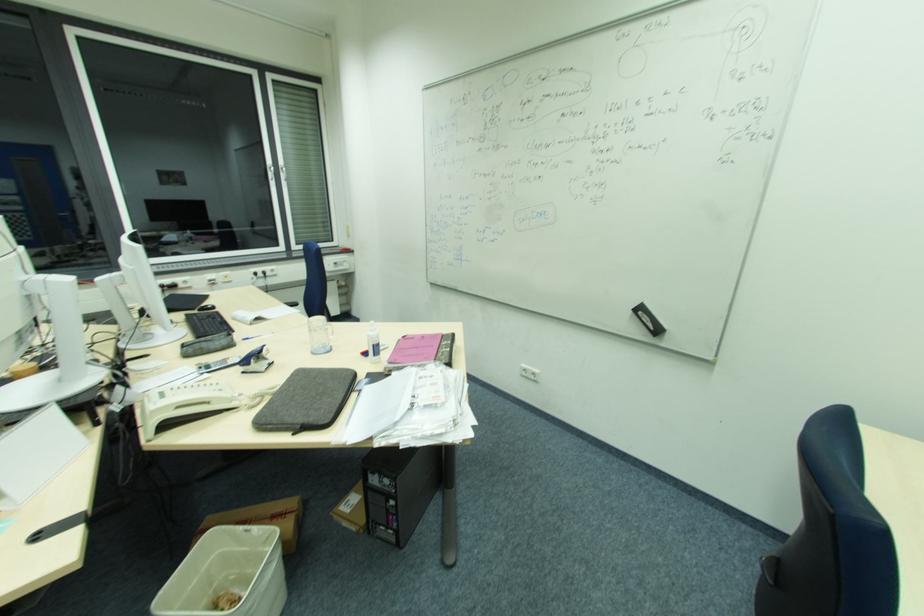
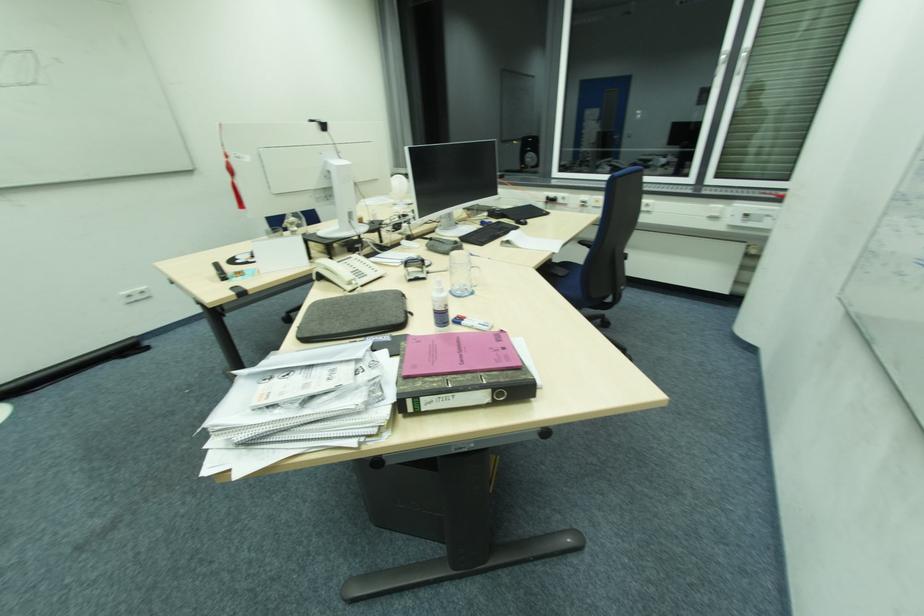
Locate, in the second image, the point that corresponds to pixel 375 345 in the first image.

(436, 310)